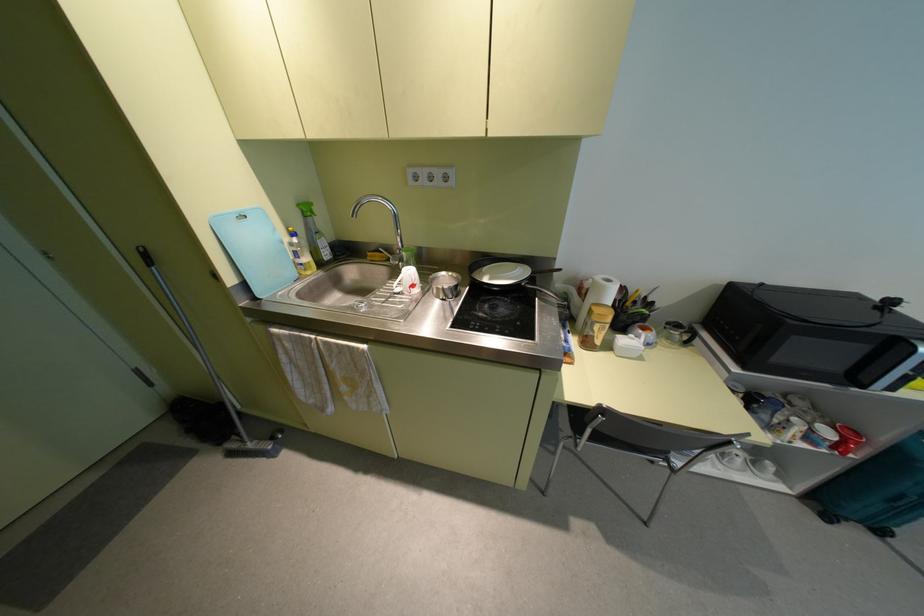
Where is `broom handle`? broom handle is located at coordinates (215, 379).